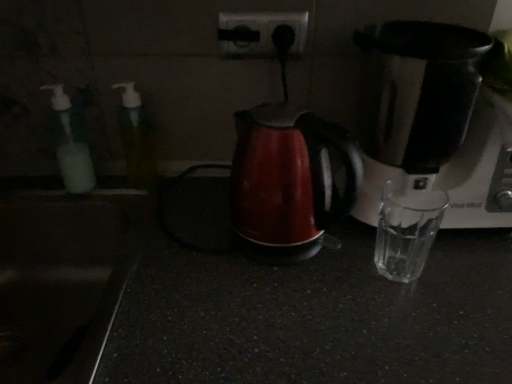
Question: Is satin black coffee maker at right thinner than translucent plastic soap dispenser at left, the 2th bottle positioned from the right?

Choices:
 (A) yes
 (B) no

Answer: (B)

Question: Is satin black coffee maker at right shorter than translucent plastic soap dispenser at left, the 1th bottle viewed from the left?

Choices:
 (A) yes
 (B) no

Answer: (B)

Question: Are satin black coffee maker at right and translucent plastic soap dispenser at left, the 2th bottle positioned from the right, making contact?

Choices:
 (A) no
 (B) yes

Answer: (A)

Question: Is satin black coffee maker at right bigger than translucent plastic soap dispenser at left, the 1th bottle viewed from the left?

Choices:
 (A) yes
 (B) no

Answer: (A)

Question: Is satin black coffee maker at right smaller than translucent plastic soap dispenser at left, the 2th bottle positioned from the right?

Choices:
 (A) yes
 (B) no

Answer: (B)

Question: From a real-world perspective, is translucent plastic bottle at left, which appears as the second bottle when viewed from the left, above or below black plastic power plugs and sockets at upper center?

Choices:
 (A) above
 (B) below

Answer: (B)

Question: Considering the positions of translucent plastic bottle at left, placed as the first bottle when sorted from right to left, and black plastic power plugs and sockets at upper center in the image, is translucent plastic bottle at left, placed as the first bottle when sorted from right to left, taller or shorter than black plastic power plugs and sockets at upper center?

Choices:
 (A) short
 (B) tall

Answer: (B)

Question: Is translucent plastic bottle at left, which appears as the second bottle when viewed from the left, wider or thinner than black plastic power plugs and sockets at upper center?

Choices:
 (A) thin
 (B) wide

Answer: (B)

Question: Considering the relative positions of translucent plastic bottle at left, which appears as the second bottle when viewed from the left, and black plastic power plugs and sockets at upper center in the image provided, is translucent plastic bottle at left, which appears as the second bottle when viewed from the left, to the left or to the right of black plastic power plugs and sockets at upper center?

Choices:
 (A) right
 (B) left

Answer: (B)

Question: Does point (136, 119) appear closer or farther from the camera than point (303, 205)?

Choices:
 (A) farther
 (B) closer

Answer: (A)

Question: Considering the positions of translucent plastic bottle at left, placed as the first bottle when sorted from right to left, and matte red kettle at center in the image, is translucent plastic bottle at left, placed as the first bottle when sorted from right to left, wider or thinner than matte red kettle at center?

Choices:
 (A) wide
 (B) thin

Answer: (B)

Question: Is translucent plastic bottle at left, placed as the first bottle when sorted from right to left, spatially inside matte red kettle at center, or outside of it?

Choices:
 (A) inside
 (B) outside

Answer: (B)

Question: From a real-world perspective, is translucent plastic bottle at left, which appears as the second bottle when viewed from the left, positioned above or below matte red kettle at center?

Choices:
 (A) above
 (B) below

Answer: (A)

Question: Is translucent plastic soap dispenser at left, the 1th bottle viewed from the left, taller or shorter than matte red kettle at center?

Choices:
 (A) tall
 (B) short

Answer: (B)

Question: Is point (68, 99) closer or farther from the camera than point (271, 178)?

Choices:
 (A) farther
 (B) closer

Answer: (A)